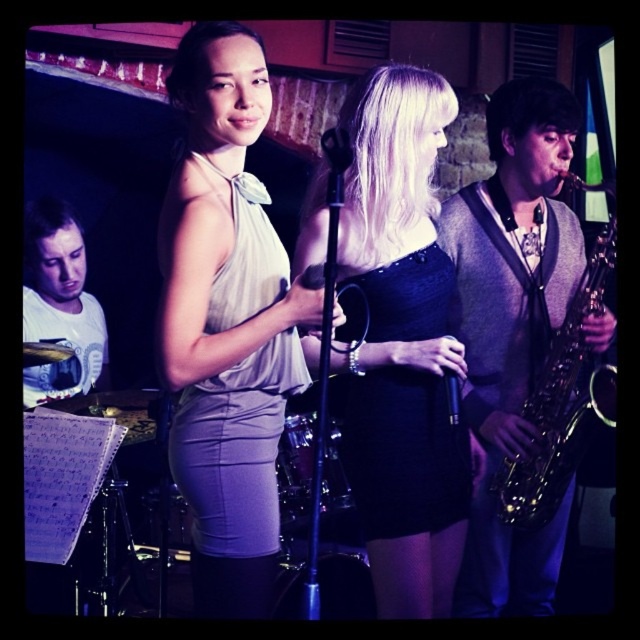
Question: Is gold metallic saxophone at right closer to the viewer compared to black satin dress at center?

Choices:
 (A) no
 (B) yes

Answer: (A)

Question: Estimate the real-world distances between objects in this image. Which object is closer to the gold metallic saxophone at right?

Choices:
 (A) black matte microphone at center
 (B) black metallic microphone at center
 (C) white matte shirt at upper left

Answer: (B)

Question: Which point appears farthest from the camera in this image?

Choices:
 (A) (552, 358)
 (B) (422, 465)

Answer: (A)

Question: Is satin beige dress at center below white matte shirt at upper left?

Choices:
 (A) yes
 (B) no

Answer: (A)

Question: Does black satin dress at center have a larger size compared to gold shiny saxophone at right?

Choices:
 (A) yes
 (B) no

Answer: (A)

Question: Which point is closer to the camera?

Choices:
 (A) black sequined dress at center
 (B) black metallic microphone at center

Answer: (A)